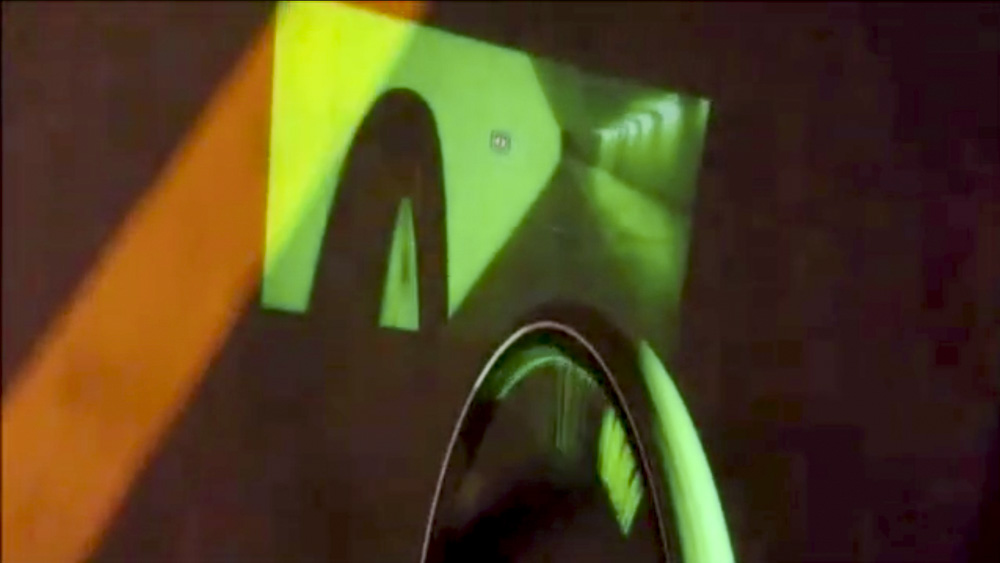
This screenshot has width=1000, height=563. I want to click on darker green wall on right, so click(x=650, y=160).